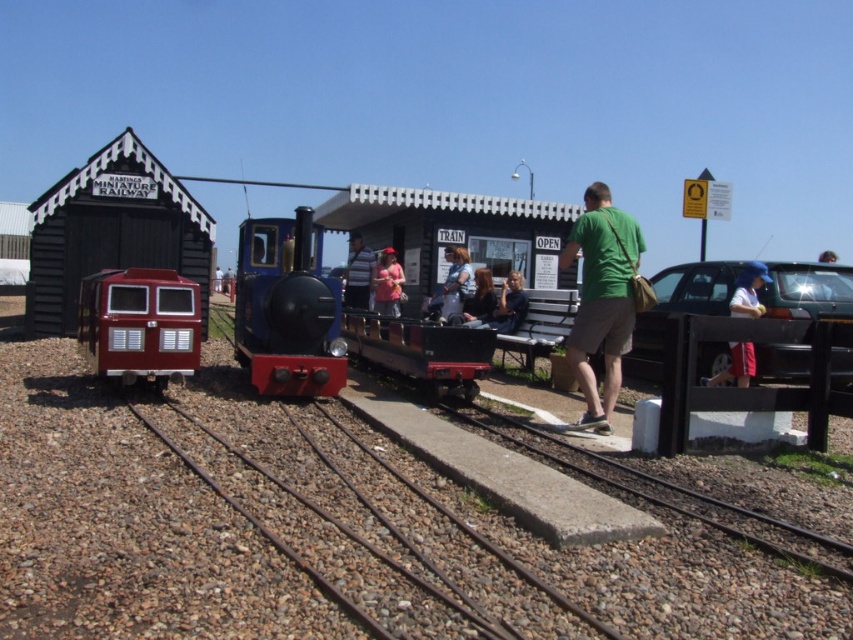
Between metallic red train car at center and rusty metal track at center, which one is positioned higher?

metallic red train car at center

Describe the element at coordinates (140, 324) in the screenshot. This screenshot has height=640, width=853. I see `metallic red train car at center` at that location.

At what (x,y) coordinates should I click in order to perform the action: click on metallic red train car at center. Please return your answer as a coordinate pair (x, y). The width and height of the screenshot is (853, 640). Looking at the image, I should click on (140, 324).

From the picture: Is blue polished wood train at center shorter than metallic silver car at right?

No, blue polished wood train at center is not shorter than metallic silver car at right.

Can you confirm if blue polished wood train at center is taller than metallic silver car at right?

Correct, blue polished wood train at center is much taller as metallic silver car at right.

Where is `blue polished wood train at center`? blue polished wood train at center is located at coordinates (287, 310).

Where is `blue polished wood train at center`? blue polished wood train at center is located at coordinates (287, 310).

Between point (279, 365) and point (91, 336), which one is positioned behind?

The point (279, 365) is more distant.

Between blue polished wood train at center and metallic red train car at center, which one has more height?

blue polished wood train at center

Between point (334, 317) and point (154, 317), which one is positioned behind?

The point (334, 317) is more distant.

The height and width of the screenshot is (640, 853). What are the coordinates of `blue polished wood train at center` in the screenshot? It's located at (287, 310).